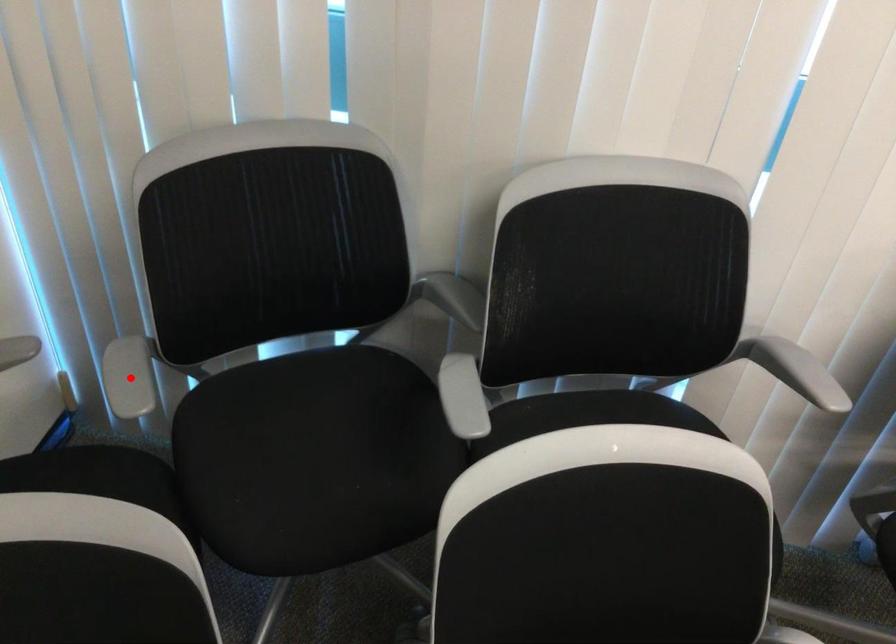
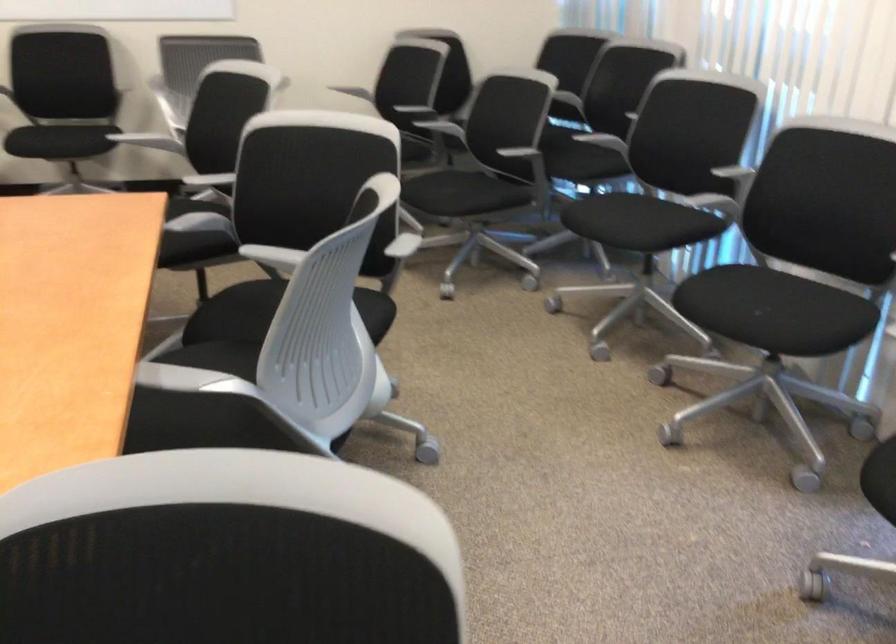
Question: I am providing you with two images of the same scene from different viewpoints. A red point is marked on the first image. Is the red point's position out of view in image 2?

Choices:
 (A) Yes
 (B) No

Answer: (A)